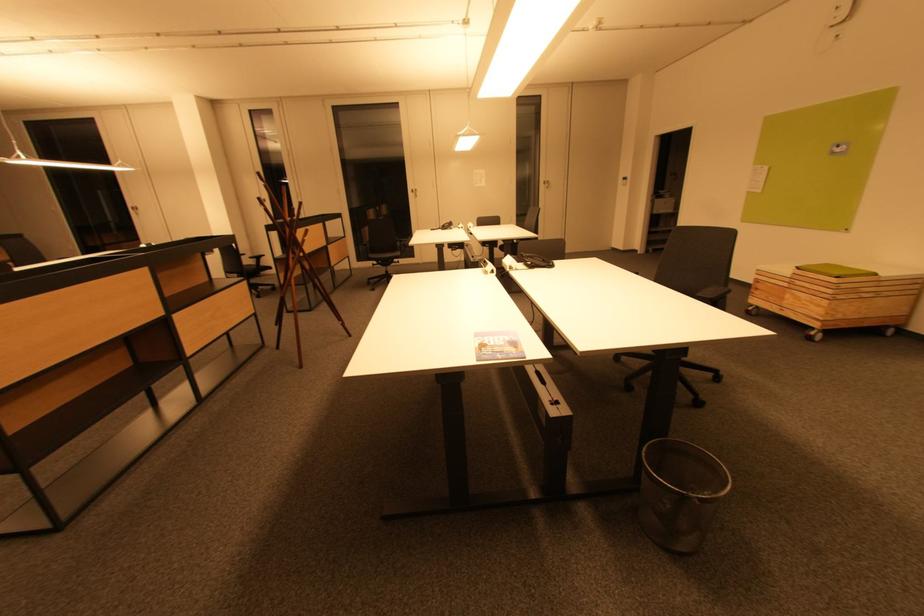
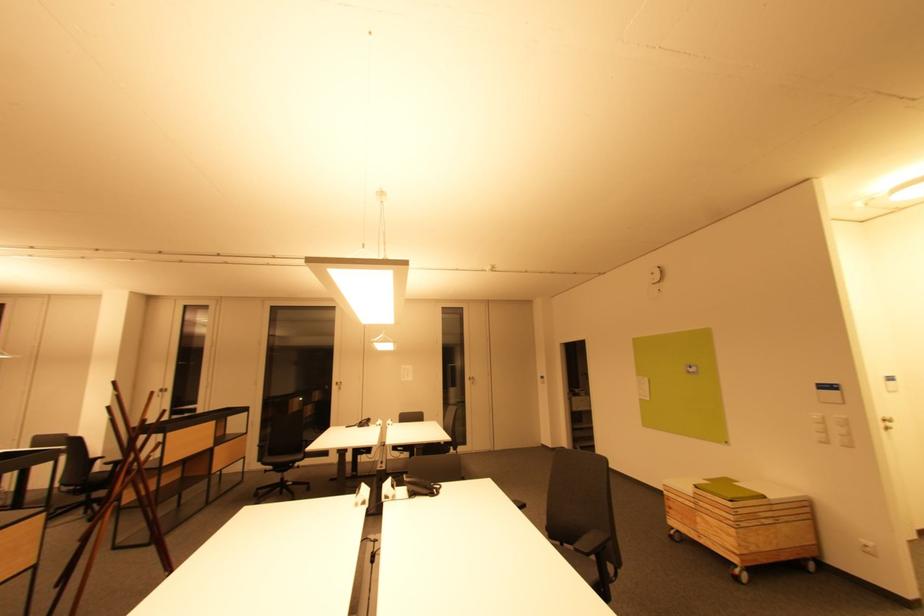
Question: The images are taken continuously from a first-person perspective. In which direction is your viewpoint rotating?

Choices:
 (A) Left
 (B) Right
 (C) Up
 (D) Down

Answer: (C)